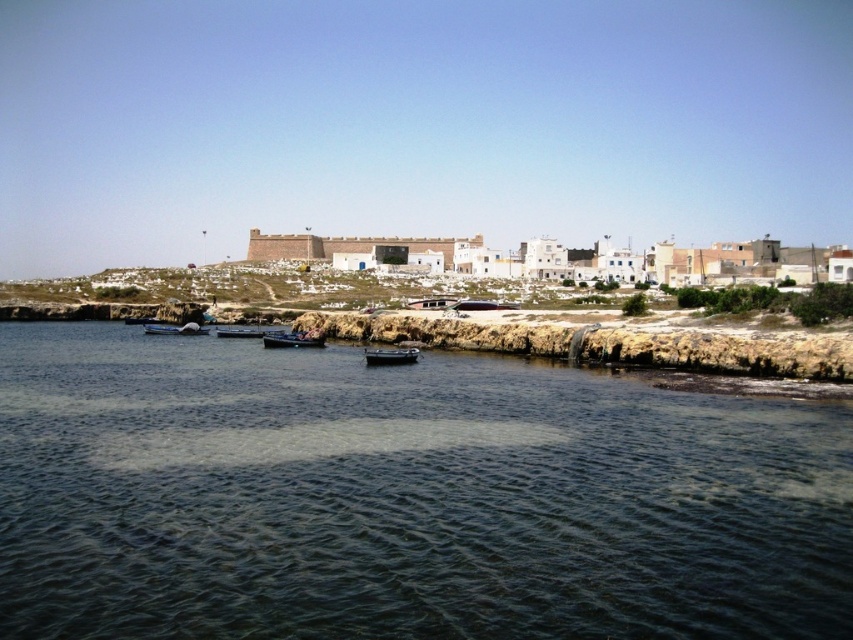
Is wooden boat at center behind wooden boat at lower left?

No, it is in front of wooden boat at lower left.

Is wooden boat at center closer to camera compared to wooden boat at lower left?

Yes, it is in front of wooden boat at lower left.

Which is behind, point (236, 328) or point (177, 324)?

The point (177, 324) is more distant.

Where is `wooden boat at center`? wooden boat at center is located at coordinates (248, 332).

Who is lower down, black rubber boat at lower center or wooden boat at lower left?

black rubber boat at lower center is below.

Is black rubber boat at lower center bigger than wooden boat at lower left?

No.

Is point (376, 353) closer to camera compared to point (184, 326)?

Yes, point (376, 353) is closer to viewer.

You are a GUI agent. You are given a task and a screenshot of the screen. Output one action in this format:
    pyautogui.click(x=<x>, y=<y>)
    Task: Click on the black rubber boat at lower center
    The width and height of the screenshot is (853, 640).
    Given the screenshot: What is the action you would take?
    pyautogui.click(x=390, y=355)

Is smooth wooden boat at center further to camera compared to wooden boat at lower left?

That is False.

Between point (305, 342) and point (183, 333), which one is positioned behind?

Point (183, 333)

Who is more forward, (320,342) or (190,324)?

Positioned in front is point (320,342).

At what (x,y) coordinates should I click in order to perform the action: click on smooth wooden boat at center. Please return your answer as a coordinate pair (x, y). This screenshot has height=640, width=853. Looking at the image, I should click on (293, 339).